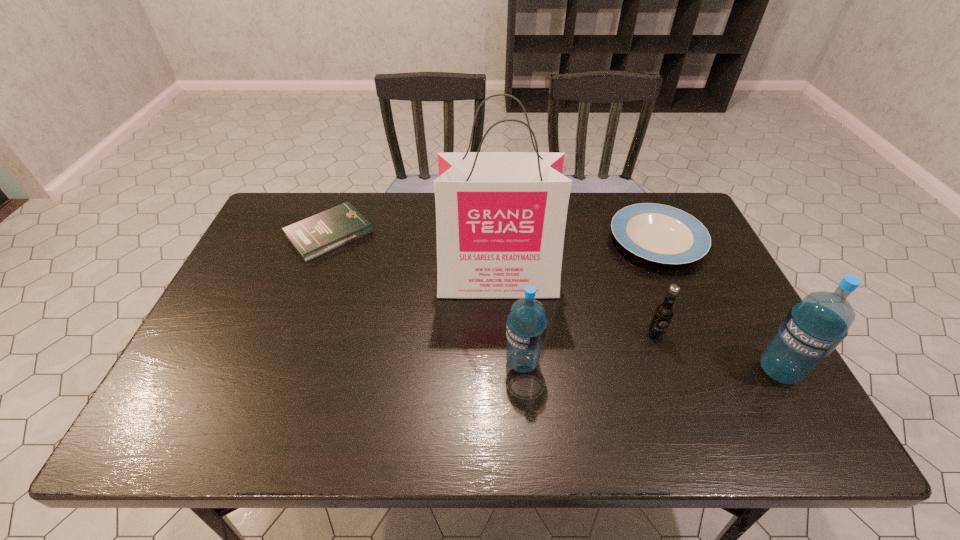
You are a GUI agent. You are given a task and a screenshot of the screen. Output one action in this format:
    pyautogui.click(x=<x>, y=<y>)
    Task: Click on the object that ranks as the second closest to the leftmost object
    The image size is (960, 540).
    Given the screenshot: What is the action you would take?
    pyautogui.click(x=526, y=325)

Identify which object is the fourth nearest to the right water bottle. Please provide its 2D coordinates. Your answer should be formatted as a tuple, i.e. [(x, y)], where the tuple contains the x and y coordinates of a point satisfying the conditions above.

[(526, 325)]

Image resolution: width=960 pixels, height=540 pixels. I want to click on vacant point that satisfies the following two spatial constraints: 1. on the front side of the second shortest object; 2. on the left side of the leftmost object, so click(x=327, y=240).